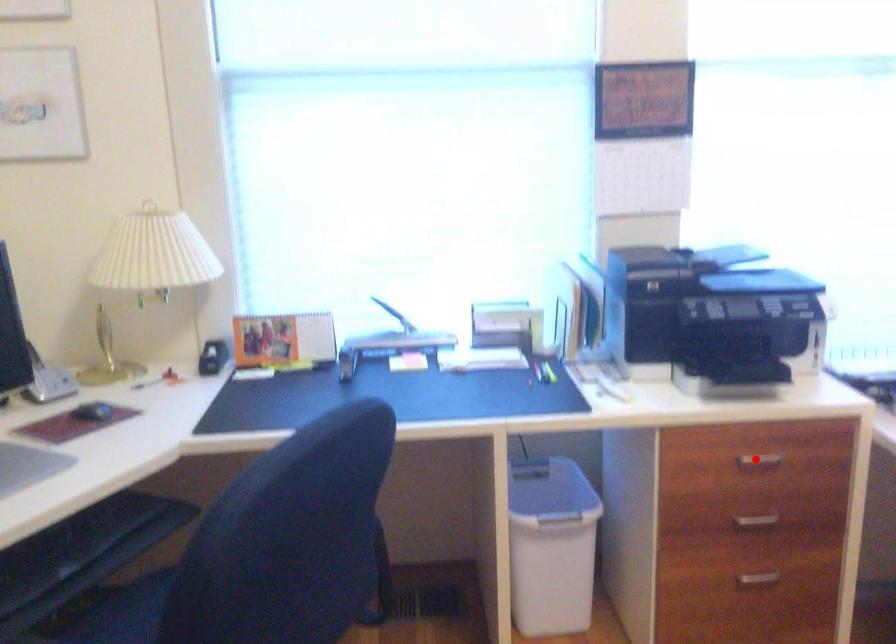
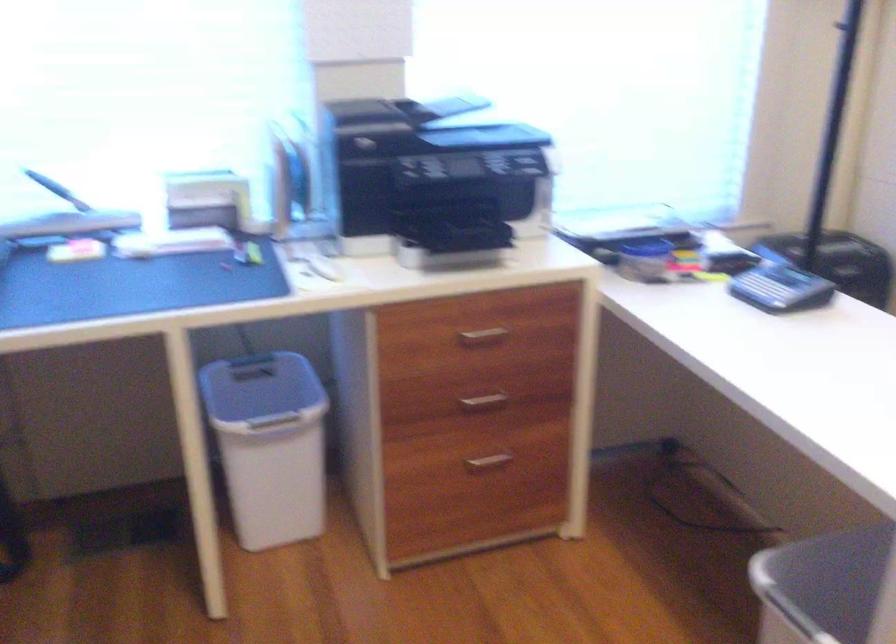
Question: I am providing you with two images of the same scene from different viewpoints. In image1, a red point is highlighted. Considering the same 3D point in image2, which of the following is correct?

Choices:
 (A) It is closer
 (B) It is farther

Answer: (A)